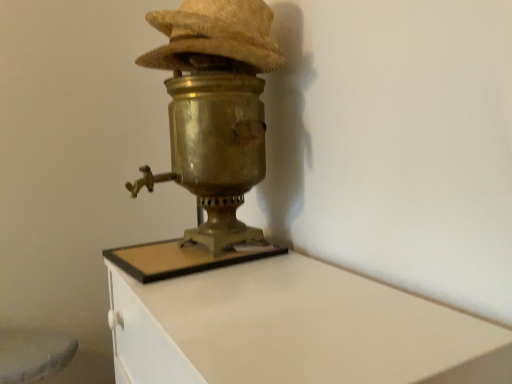
At what (x,y) coordinates should I click in order to perform the action: click on unoccupied region to the right of brass/bronze table lamp at center. Please return your answer as a coordinate pair (x, y). Looking at the image, I should click on (303, 261).